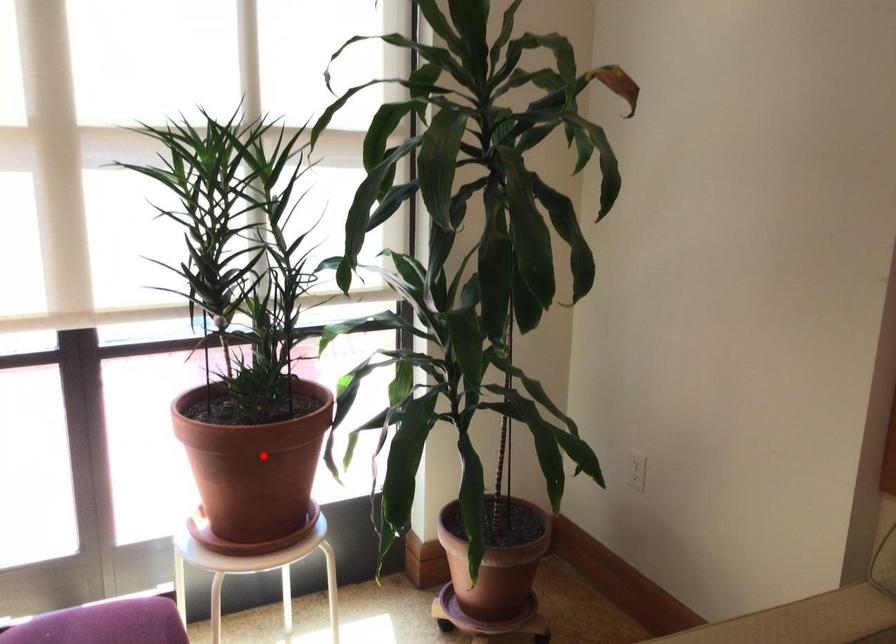
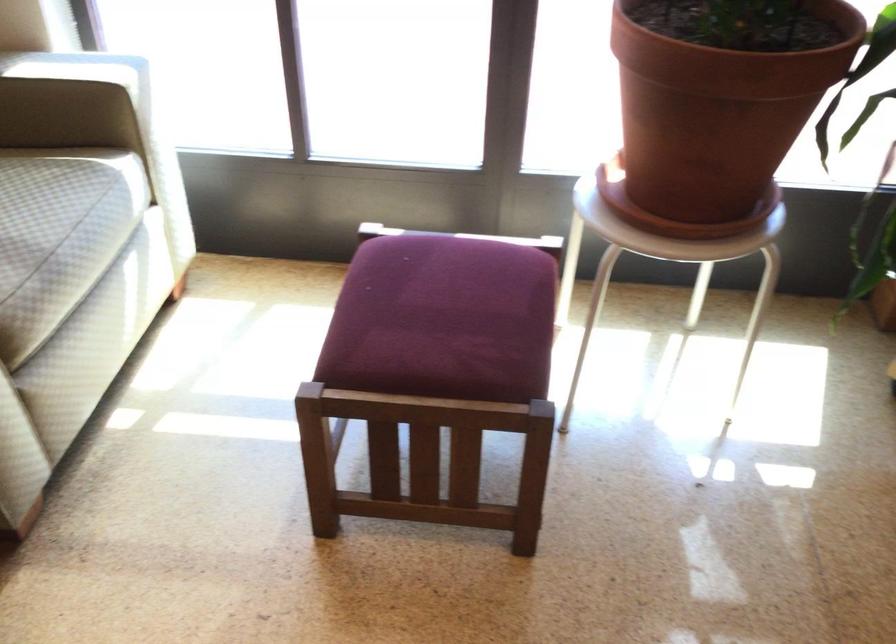
Find the pixel in the second image that matches the highlighted location in the first image.

(719, 98)